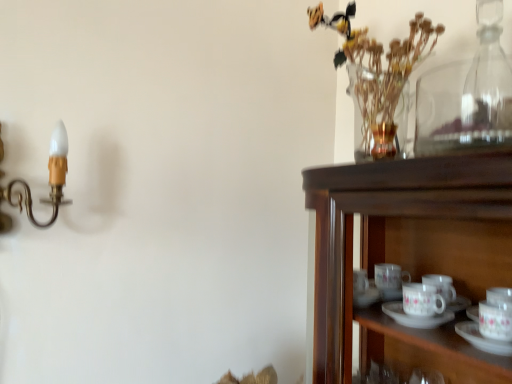
Question: Is clear glass vase at upper right oriented away from transparent glass bottle at upper right?

Choices:
 (A) yes
 (B) no

Answer: (B)

Question: Is clear glass vase at upper right aimed at transparent glass bottle at upper right?

Choices:
 (A) no
 (B) yes

Answer: (A)

Question: From the image's perspective, is clear glass vase at upper right above transparent glass bottle at upper right?

Choices:
 (A) no
 (B) yes

Answer: (B)

Question: Considering the relative sizes of clear glass vase at upper right and transparent glass bottle at upper right in the image provided, is clear glass vase at upper right shorter than transparent glass bottle at upper right?

Choices:
 (A) no
 (B) yes

Answer: (A)

Question: Is clear glass vase at upper right to the left of transparent glass bottle at upper right from the viewer's perspective?

Choices:
 (A) no
 (B) yes

Answer: (B)

Question: Is point (65, 148) positioned closer to the camera than point (498, 77)?

Choices:
 (A) farther
 (B) closer

Answer: (A)

Question: Considering the positions of gold brass candle holder at left and transparent glass bottle at upper right in the image, is gold brass candle holder at left wider or thinner than transparent glass bottle at upper right?

Choices:
 (A) thin
 (B) wide

Answer: (B)

Question: Is gold brass candle holder at left taller or shorter than transparent glass bottle at upper right?

Choices:
 (A) short
 (B) tall

Answer: (A)

Question: In the image, is gold brass candle holder at left positioned in front of or behind transparent glass bottle at upper right?

Choices:
 (A) behind
 (B) front

Answer: (B)

Question: Visually, is gold brass candle holder at left positioned to the left or to the right of clear glass vase at upper right?

Choices:
 (A) right
 (B) left

Answer: (B)

Question: From a real-world perspective, is gold brass candle holder at left positioned above or below clear glass vase at upper right?

Choices:
 (A) below
 (B) above

Answer: (A)

Question: Is gold brass candle holder at left in front of or behind clear glass vase at upper right in the image?

Choices:
 (A) behind
 (B) front

Answer: (B)

Question: Considering the positions of gold brass candle holder at left and clear glass vase at upper right in the image, is gold brass candle holder at left bigger or smaller than clear glass vase at upper right?

Choices:
 (A) small
 (B) big

Answer: (A)

Question: Based on their sizes in the image, would you say clear glass vase at upper right is bigger or smaller than gold brass candle holder at left?

Choices:
 (A) big
 (B) small

Answer: (A)

Question: From a real-world perspective, relative to gold brass candle holder at left, is clear glass vase at upper right vertically above or below?

Choices:
 (A) below
 (B) above

Answer: (B)